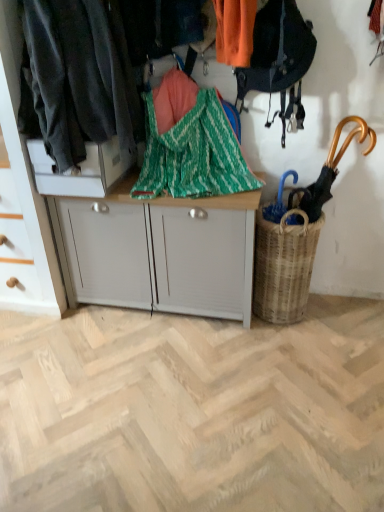
The height and width of the screenshot is (512, 384). What do you see at coordinates (77, 78) in the screenshot?
I see `dark gray fabric at left` at bounding box center [77, 78].

Describe the element at coordinates (284, 266) in the screenshot. I see `woven brown basket at lower right` at that location.

Describe the element at coordinates (330, 170) in the screenshot. I see `wooden umbrella at right` at that location.

This screenshot has width=384, height=512. Find the location of `white matte cabinet at center`. white matte cabinet at center is located at coordinates (158, 252).

Find the location of `dark gray fabric at left`. dark gray fabric at left is located at coordinates (77, 78).

Which is behind, point (54, 68) or point (280, 240)?

The point (280, 240) is farther.

Based on their positions, is dark gray fabric at left located to the left or right of woven brown basket at lower right?

Based on their positions, dark gray fabric at left is located to the left of woven brown basket at lower right.

From the image's perspective, is dark gray fabric at left above woven brown basket at lower right?

Yes, from the image's perspective, dark gray fabric at left is on top of woven brown basket at lower right.

Is dark gray fabric at left shorter than woven brown basket at lower right?

No.

From the picture: From a real-world perspective, is green zigzag fabric at center above or below white matte cabinet at left, which is counted as the second cabinetry, starting from the right?

green zigzag fabric at center is situated higher than white matte cabinet at left, which is counted as the second cabinetry, starting from the right, in the real world.

Image resolution: width=384 pixels, height=512 pixels. Find the location of `cabinetry that is the 2nd one below the green zigzag fabric at center (from a real-world perspective)`. cabinetry that is the 2nd one below the green zigzag fabric at center (from a real-world perspective) is located at coordinates (26, 181).

Is green zigzag fabric at center next to white matte cabinet at left, which is counted as the second cabinetry, starting from the right?

No.

In the scene shown: From the image's perspective, does green zigzag fabric at center appear lower than white matte cabinet at left, which is the first cabinetry from left to right?

No.

From the picture: Is white matte cabinet at upper left, which appears as the first cabinetry when viewed from the right, smaller than white matte cabinet at left, which is the first cabinetry from left to right?

Yes.

Can you tell me how much white matte cabinet at upper left, the second cabinetry from the left, and white matte cabinet at left, which is the first cabinetry from left to right, differ in facing direction?

There is a 1.63e-05-degree angle between the facing directions of white matte cabinet at upper left, the second cabinetry from the left, and white matte cabinet at left, which is the first cabinetry from left to right.

From the image's perspective, who appears lower, white matte cabinet at upper left, the second cabinetry from the left, or white matte cabinet at left, which is counted as the second cabinetry, starting from the right?

white matte cabinet at left, which is counted as the second cabinetry, starting from the right.

From a real-world perspective, between white matte cabinet at upper left, which appears as the first cabinetry when viewed from the right, and white matte cabinet at left, which is counted as the second cabinetry, starting from the right, who is vertically lower?

From a 3D spatial view, white matte cabinet at left, which is counted as the second cabinetry, starting from the right, is below.

Could you tell me if white matte cabinet at upper left, which appears as the first cabinetry when viewed from the right, is turned towards dark gray fabric at left?

No, white matte cabinet at upper left, which appears as the first cabinetry when viewed from the right, is not aimed at dark gray fabric at left.

Looking at this image, is white matte cabinet at upper left, which appears as the first cabinetry when viewed from the right, in contact with dark gray fabric at left?

white matte cabinet at upper left, which appears as the first cabinetry when viewed from the right, and dark gray fabric at left are not in contact.

Which of these two, white matte cabinet at upper left, the second cabinetry from the left, or dark gray fabric at left, stands shorter?

white matte cabinet at upper left, the second cabinetry from the left, is shorter.

Considering the relative positions of white matte cabinet at upper left, the second cabinetry from the left, and dark gray fabric at left in the image provided, is white matte cabinet at upper left, the second cabinetry from the left, to the left of dark gray fabric at left from the viewer's perspective?

Result: Yes.

Can you confirm if white matte cabinet at center is wider than wooden umbrella at right?

Correct, the width of white matte cabinet at center exceeds that of wooden umbrella at right.

Measure the distance from white matte cabinet at center to wooden umbrella at right.

white matte cabinet at center is 21.67 inches from wooden umbrella at right.

Does white matte cabinet at center have a larger size compared to wooden umbrella at right?

Correct, white matte cabinet at center is larger in size than wooden umbrella at right.

Is wooden umbrella at right not near green zigzag fabric at center?

No, wooden umbrella at right is not far away from green zigzag fabric at center.

Looking at this image, how distant is wooden umbrella at right from green zigzag fabric at center?

18.05 inches.

Between wooden umbrella at right and green zigzag fabric at center, which one has smaller size?

wooden umbrella at right.

Is white matte cabinet at center not near white matte cabinet at upper left, the second cabinetry from the left?

white matte cabinet at center is actually quite close to white matte cabinet at upper left, the second cabinetry from the left.

In the image, is white matte cabinet at center positioned in front of or behind white matte cabinet at upper left, which appears as the first cabinetry when viewed from the right?

In the image, white matte cabinet at center appears behind white matte cabinet at upper left, which appears as the first cabinetry when viewed from the right.

Is white matte cabinet at center wider or thinner than white matte cabinet at upper left, the second cabinetry from the left?

Clearly, white matte cabinet at center has less width compared to white matte cabinet at upper left, the second cabinetry from the left.

Between white matte cabinet at center and white matte cabinet at upper left, the second cabinetry from the left, which one has more height?

white matte cabinet at center is taller.

Where is `basket below the dark gray fabric at left (from a real-world perspective)`? basket below the dark gray fabric at left (from a real-world perspective) is located at coordinates (284, 266).

Starting from the green zigzag fabric at center, which cabinetry is the 1st one behind? Please provide its 2D coordinates.

[(26, 181)]

When comparing their distances from dark gray fabric at left, does woven brown basket at lower right or white matte cabinet at left, which is counted as the second cabinetry, starting from the right, seem closer?

white matte cabinet at left, which is counted as the second cabinetry, starting from the right.

When comparing their distances from white matte cabinet at left, which is the first cabinetry from left to right, does white matte cabinet at center or white matte cabinet at upper left, the second cabinetry from the left, seem further?

white matte cabinet at center is positioned further to the anchor white matte cabinet at left, which is the first cabinetry from left to right.

When comparing their distances from green zigzag fabric at center, does white matte cabinet at center or wooden umbrella at right seem closer?

Among the two, white matte cabinet at center is located nearer to green zigzag fabric at center.

Estimate the real-world distances between objects in this image. Which object is closer to white matte cabinet at upper left, which appears as the first cabinetry when viewed from the right, white matte cabinet at center or wooden umbrella at right?

Based on the image, white matte cabinet at center appears to be nearer to white matte cabinet at upper left, which appears as the first cabinetry when viewed from the right.

Looking at the image, which one is located closer to white matte cabinet at left, which is the first cabinetry from left to right, dark gray fabric at left or woven brown basket at lower right?

dark gray fabric at left is closer to white matte cabinet at left, which is the first cabinetry from left to right.

Looking at the image, which one is located further to white matte cabinet at upper left, which appears as the first cabinetry when viewed from the right, white matte cabinet at center or white matte cabinet at left, which is the first cabinetry from left to right?

Among the two, white matte cabinet at center is located further to white matte cabinet at upper left, which appears as the first cabinetry when viewed from the right.

Which object lies further to the anchor point white matte cabinet at left, which is the first cabinetry from left to right, white matte cabinet at center or green zigzag fabric at center?

green zigzag fabric at center lies further to white matte cabinet at left, which is the first cabinetry from left to right, than the other object.

When comparing their distances from white matte cabinet at center, does white matte cabinet at upper left, which appears as the first cabinetry when viewed from the right, or white matte cabinet at left, which is counted as the second cabinetry, starting from the right, seem closer?

white matte cabinet at upper left, which appears as the first cabinetry when viewed from the right, lies closer to white matte cabinet at center than the other object.

Identify the location of desk between white matte cabinet at left, which is the first cabinetry from left to right, and green zigzag fabric at center. (158, 252).

Identify the location of clothing between white matte cabinet at left, which is the first cabinetry from left to right, and white matte cabinet at center. This screenshot has height=512, width=384. (77, 78).

The image size is (384, 512). Identify the location of basket between white matte cabinet at left, which is counted as the second cabinetry, starting from the right, and wooden umbrella at right from left to right. (284, 266).

At what (x,y) coordinates should I click in order to perform the action: click on clothing between white matte cabinet at left, which is counted as the second cabinetry, starting from the right, and green zigzag fabric at center, in the horizontal direction. Please return your answer as a coordinate pair (x, y). This screenshot has width=384, height=512. Looking at the image, I should click on (77, 78).